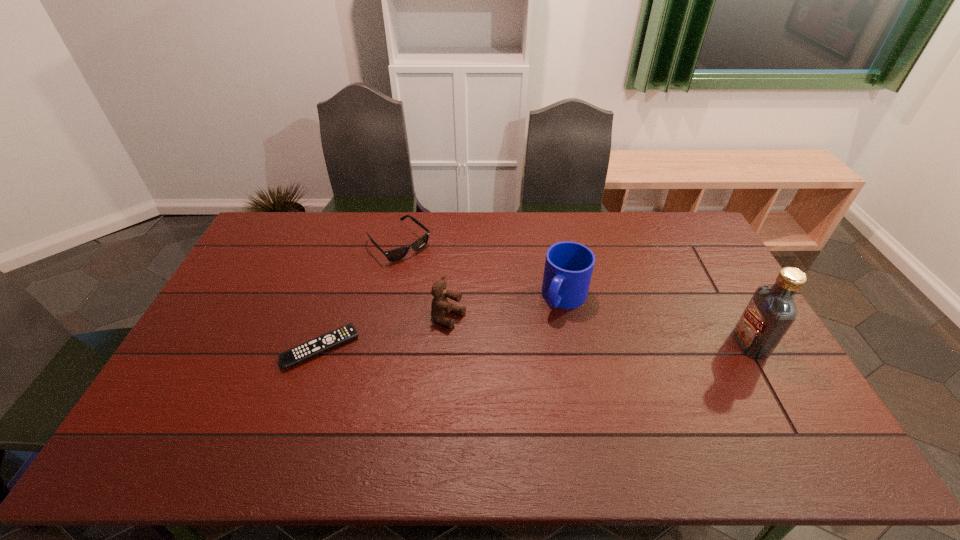
What are the coordinates of `vacant area that lies between the teddy bear and the farthest object` in the screenshot? It's located at (424, 281).

Find the location of a particular element. The width and height of the screenshot is (960, 540). vacant space that's between the mug and the farthest object is located at coordinates (482, 271).

This screenshot has height=540, width=960. I want to click on blank region between the remote control and the sunglasses, so click(360, 296).

Find the location of a particular element. Image resolution: width=960 pixels, height=540 pixels. blank region between the second object from right to left and the farthest object is located at coordinates (482, 271).

In order to click on vacant space in between the fourth object from left to right and the rightmost object in this screenshot , I will do `click(658, 321)`.

Locate an element on the screen. empty space that is in between the third object from left to right and the shortest object is located at coordinates (385, 333).

At what (x,y) coordinates should I click in order to perform the action: click on object identified as the third closest to the second shortest object. Please return your answer as a coordinate pair (x, y). The height and width of the screenshot is (540, 960). Looking at the image, I should click on (569, 265).

Select which object appears as the closest to the rightmost object. Please provide its 2D coordinates. Your answer should be formatted as a tuple, i.e. [(x, y)], where the tuple contains the x and y coordinates of a point satisfying the conditions above.

[(569, 265)]

Find the location of `blank area in the image that satisfies the following two spatial constraints: 1. on the front side of the tallest object; 2. on the front-facing side of the second object from right to left`. blank area in the image that satisfies the following two spatial constraints: 1. on the front side of the tallest object; 2. on the front-facing side of the second object from right to left is located at coordinates (574, 343).

Find the location of `vacant space that satisfies the following two spatial constraints: 1. on the front side of the vodka; 2. on the front-facing side of the mug`. vacant space that satisfies the following two spatial constraints: 1. on the front side of the vodka; 2. on the front-facing side of the mug is located at coordinates (574, 343).